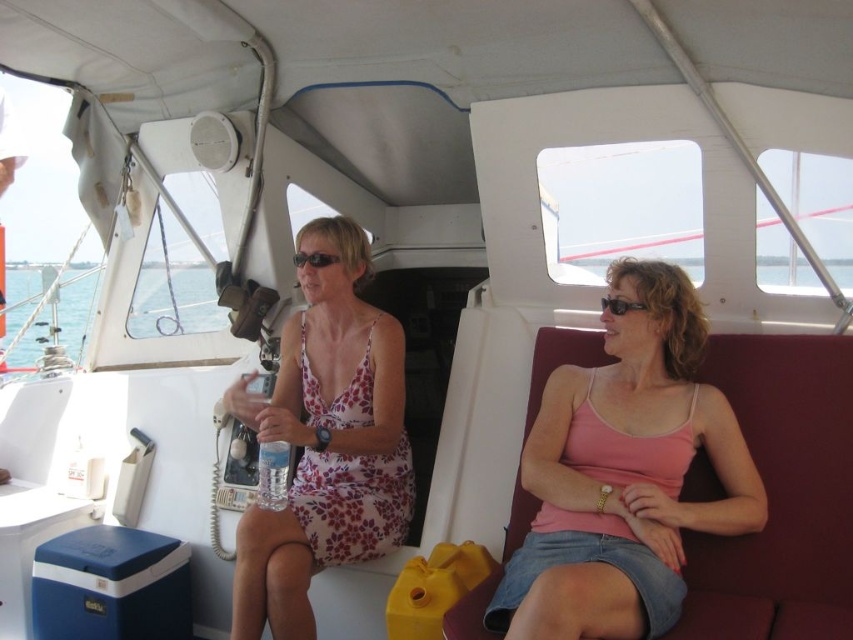
You are a passenger on a boat and need to reach the clear plastic water bottle at center without disturbing the floral fabric dress at center. Can you safely extend your hand to grab it from your current position?

The distance between the floral fabric dress at center and the clear plastic water bottle at center is 9.99 inches, so yes, you can safely extend your hand to grab the clear plastic water bottle at center without disturbing the floral fabric dress at center.

You are a photographer trying to capture a clear image of both the black plastic sunglasses at center and the black plastic goggles at center. Since they are both at the center, which one is closer to the left side of the frame?

The black plastic sunglasses at center is positioned on the left side of black plastic goggles at center, so the sunglasses are closer to the left side of the frame.